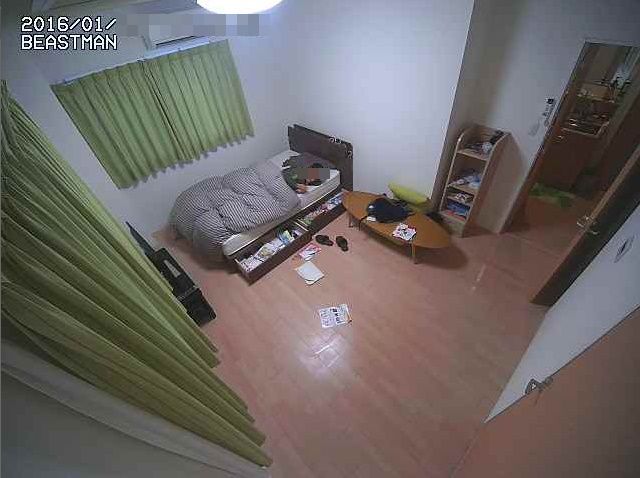
Find the location of `white mattress`. white mattress is located at coordinates (317, 195).